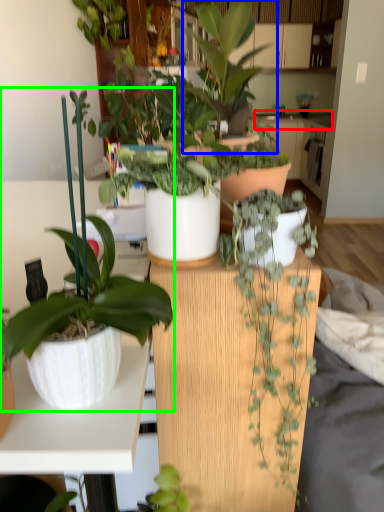
Question: Which is farther away from counter top (highlighted by a red box)? houseplant (highlighted by a blue box) or houseplant (highlighted by a green box)?

Choices:
 (A) houseplant
 (B) houseplant

Answer: (B)